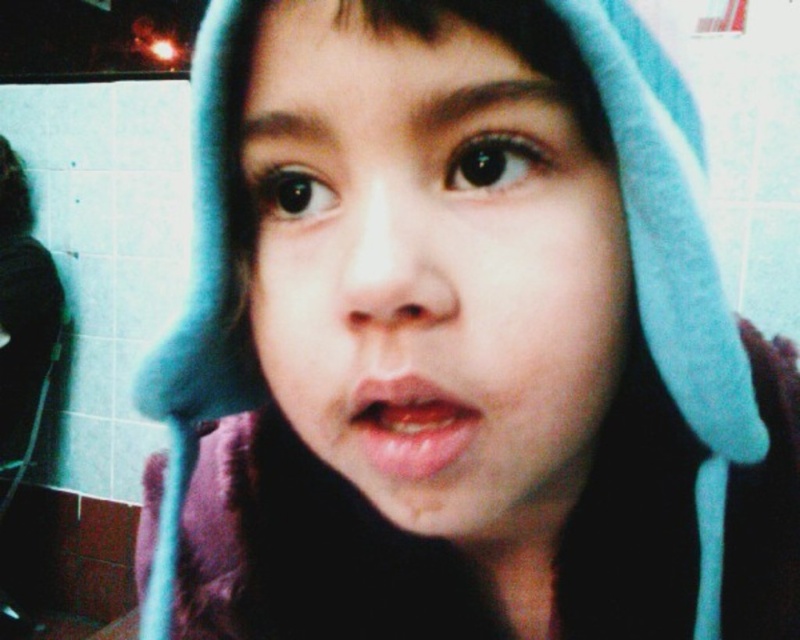
Locate an element on the screen. The height and width of the screenshot is (640, 800). smooth skin face at center is located at coordinates coord(430,266).

Which is behind, point (300, 266) or point (374, 449)?

Positioned behind is point (300, 266).

Locate an element on the screen. The width and height of the screenshot is (800, 640). smooth skin face at center is located at coordinates (430, 266).